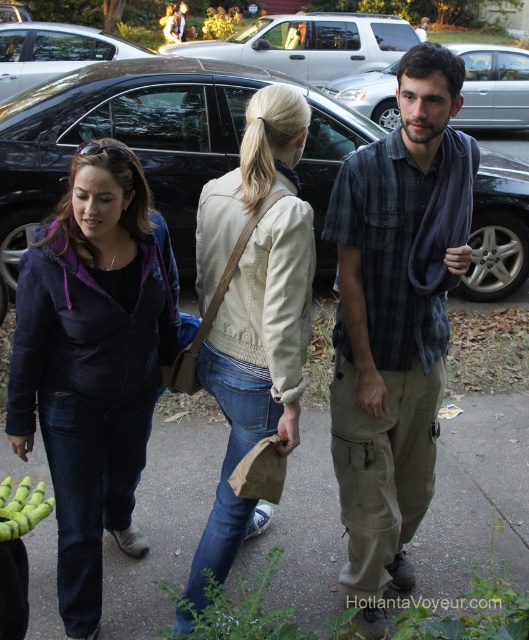
Question: Which of the following is the farthest from the observer?

Choices:
 (A) (124, 182)
 (B) (276, 132)

Answer: (B)

Question: Does plaid cotton shirt at center have a greater width compared to black matte car at center?

Choices:
 (A) no
 (B) yes

Answer: (A)

Question: Does plaid cotton shirt at center appear on the left side of black matte car at center?

Choices:
 (A) no
 (B) yes

Answer: (A)

Question: Is brown paper bag at center to the right of glossy black car at center from the viewer's perspective?

Choices:
 (A) yes
 (B) no

Answer: (A)

Question: Which object is closer to the camera taking this photo?

Choices:
 (A) beige leather jacket at center
 (B) plaid cotton shirt at center
 (C) purple matte jacket at left

Answer: (C)

Question: Which point is closer to the camera?

Choices:
 (A) (3, 529)
 (B) (153, 634)

Answer: (A)